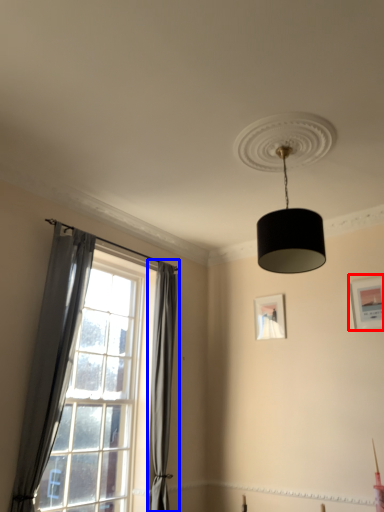
Question: Which object is closer to the camera taking this photo, picture frame (highlighted by a red box) or curtain (highlighted by a blue box)?

Choices:
 (A) picture frame
 (B) curtain

Answer: (B)